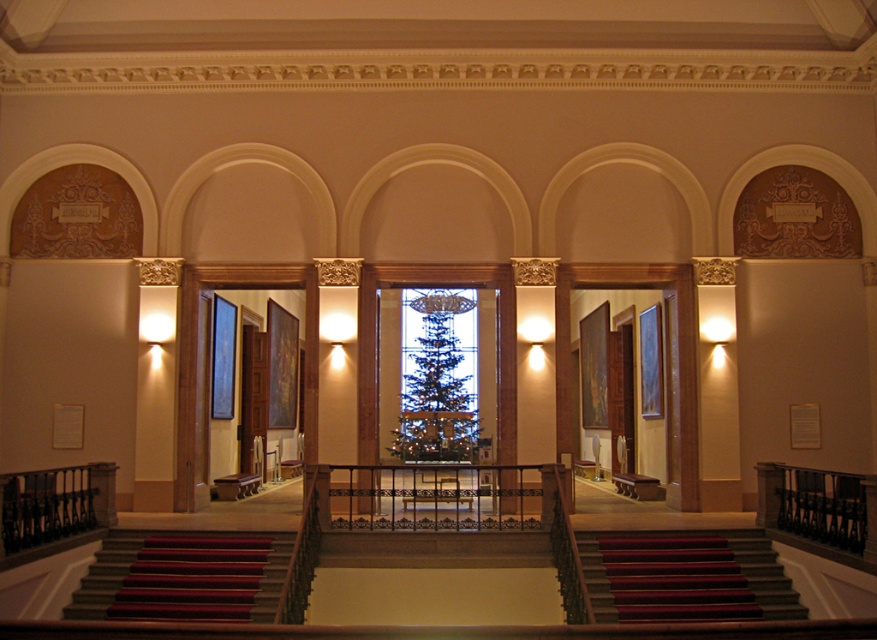
Question: Can you confirm if dark gray carpeted stairs at center is smaller than dark red carpeted stairs at lower center?

Choices:
 (A) yes
 (B) no

Answer: (B)

Question: Does red carpeted stairs at lower left have a greater width compared to green stained glass window at center?

Choices:
 (A) yes
 (B) no

Answer: (A)

Question: Is dark gray carpeted stairs at center positioned in front of green stained glass window at center?

Choices:
 (A) no
 (B) yes

Answer: (B)

Question: Which object is farther from the camera taking this photo?

Choices:
 (A) dark gray carpeted stairs at center
 (B) red carpeted stairs at lower left

Answer: (B)

Question: Based on their relative distances, which object is farther from the red carpeted stairs at lower left?

Choices:
 (A) dark gray carpeted stairs at center
 (B) green stained glass window at center

Answer: (B)

Question: Among these points, which one is farthest from the camera?

Choices:
 (A) (640, 600)
 (B) (668, 547)

Answer: (B)